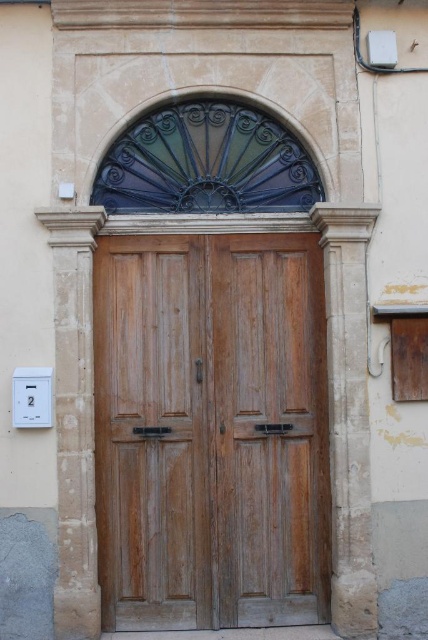
You are an electrician trying to install a new outlet. You see the wooden door at center and the white plastic electric outlet at lower left. Which object is positioned higher up in the image?

The wooden door at center is located below the white plastic electric outlet at lower left, so the outlet is higher up.

You are an electrician checking the height of the wooden door at center and the white plastic electric outlet at lower left. Which one has a greater height?

The wooden door at center is taller than the white plastic electric outlet at lower left according to the description.